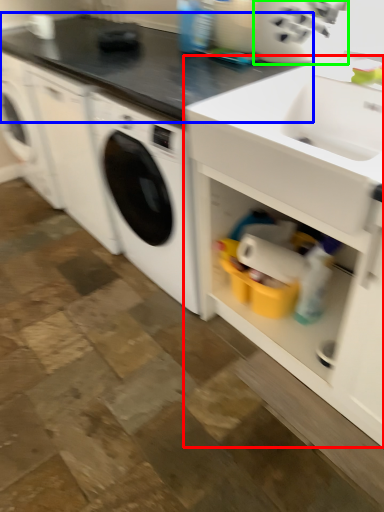
Question: Based on their relative distances, which object is nearer to cabinetry (highlighted by a red box)? Choose from countertop (highlighted by a blue box) and appliance (highlighted by a green box).

Choices:
 (A) countertop
 (B) appliance

Answer: (B)